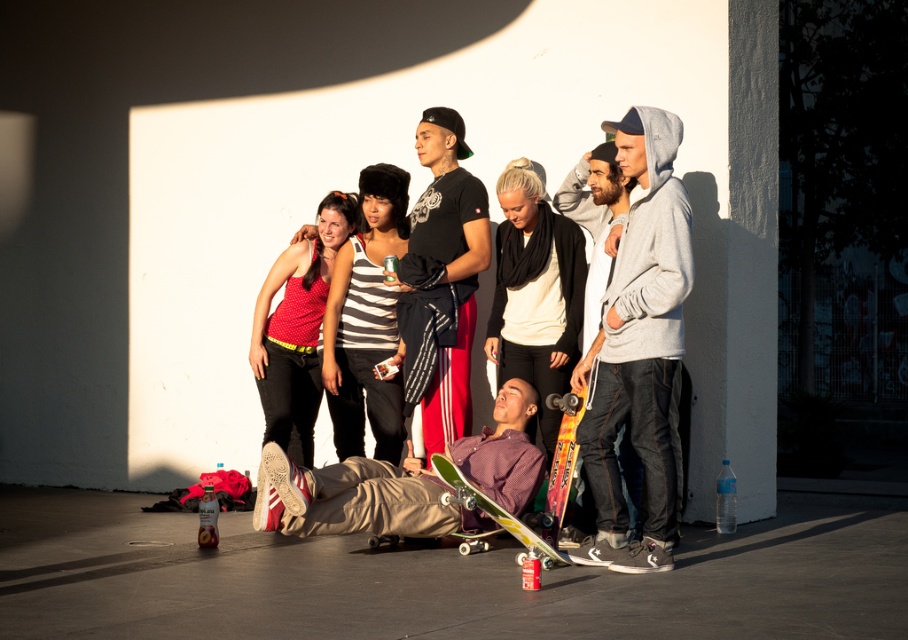
Question: Can you confirm if wooden skateboard at center is positioned above orange wood skateboard at lower center?

Choices:
 (A) no
 (B) yes

Answer: (A)

Question: Is gray hoodie at right above wooden skateboard at center?

Choices:
 (A) no
 (B) yes

Answer: (B)

Question: Which point appears closest to the camera in this image?

Choices:
 (A) (550, 403)
 (B) (550, 557)
 (C) (643, 368)

Answer: (C)

Question: Which is farther from the wooden skateboard at center?

Choices:
 (A) green wooden skateboard at center
 (B) orange wood skateboard at lower center

Answer: (B)

Question: Where is gray hoodie at right located in relation to green wooden skateboard at center in the image?

Choices:
 (A) right
 (B) left

Answer: (A)

Question: Which of the following is the farthest from the observer?

Choices:
 (A) (490, 504)
 (B) (455, 192)
 (C) (620, 166)

Answer: (B)